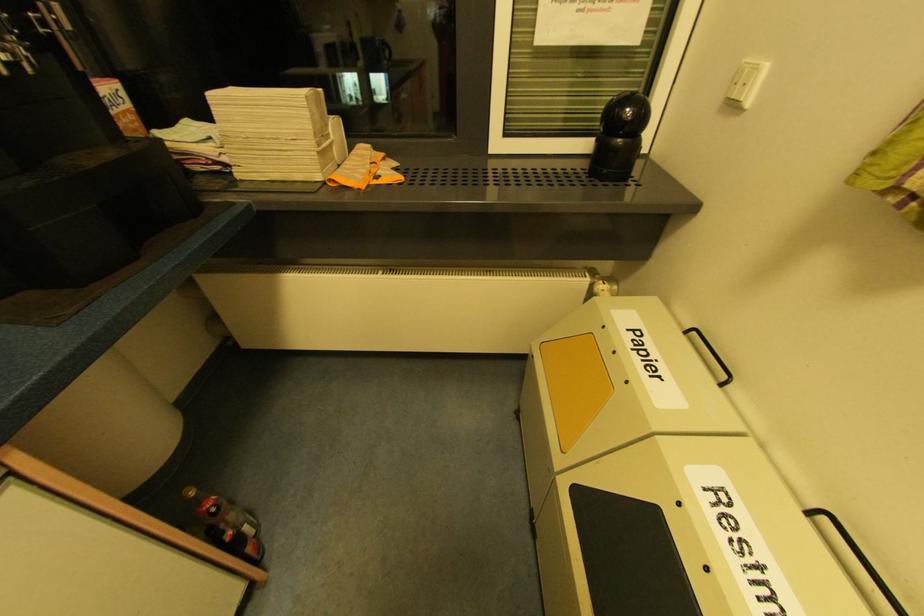
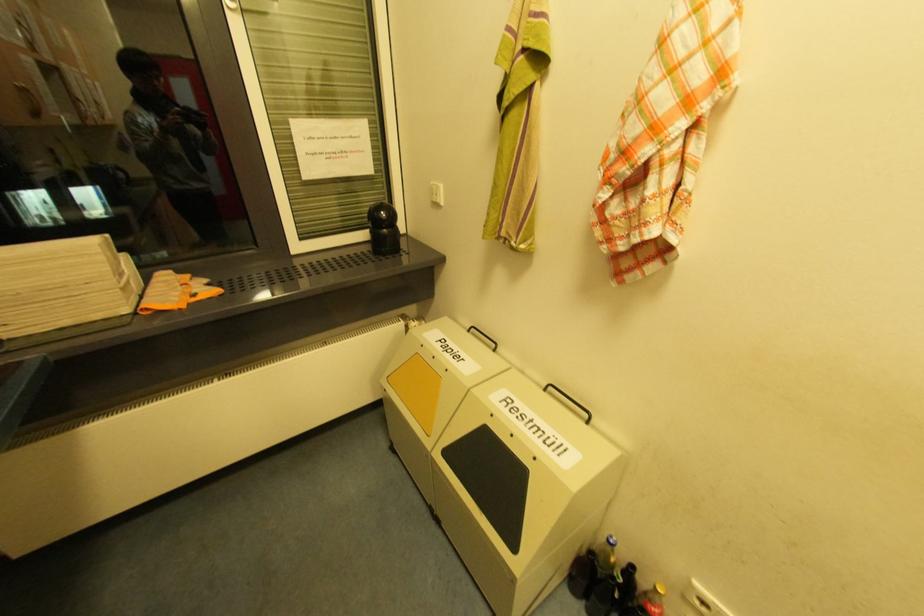
The point at (736, 107) is marked in the first image. Where is the corresponding point in the second image?

(440, 205)